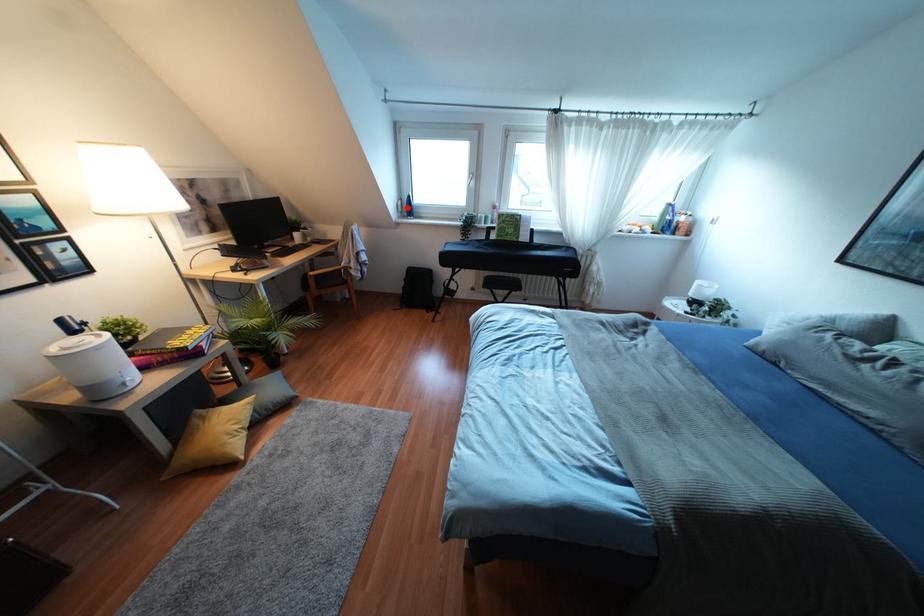
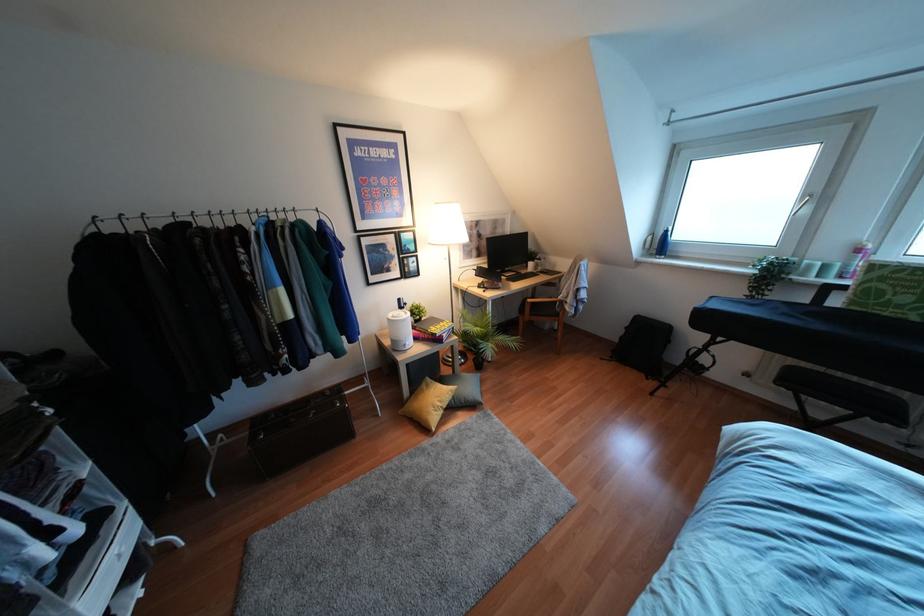
The point at the highlighted location is marked in the first image. Where is the corresponding point in the second image?

(660, 245)